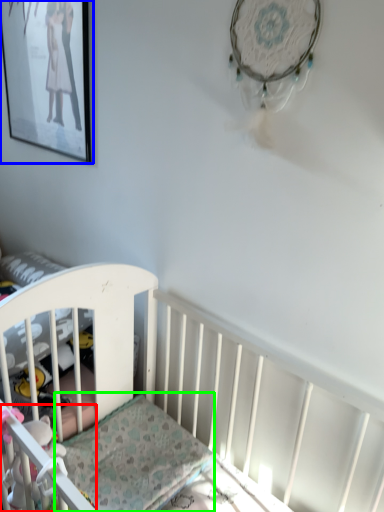
Question: Which is nearer to the toy (highlighted by a red box)? picture frame (highlighted by a blue box) or mattress (highlighted by a green box).

Choices:
 (A) picture frame
 (B) mattress

Answer: (B)